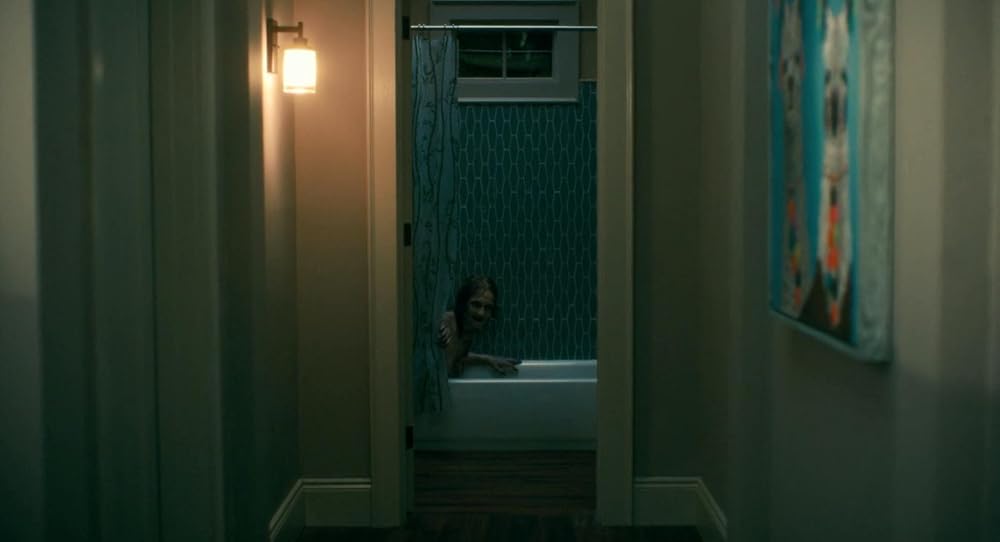
Find the location of a particular element. light is located at coordinates (308, 70).